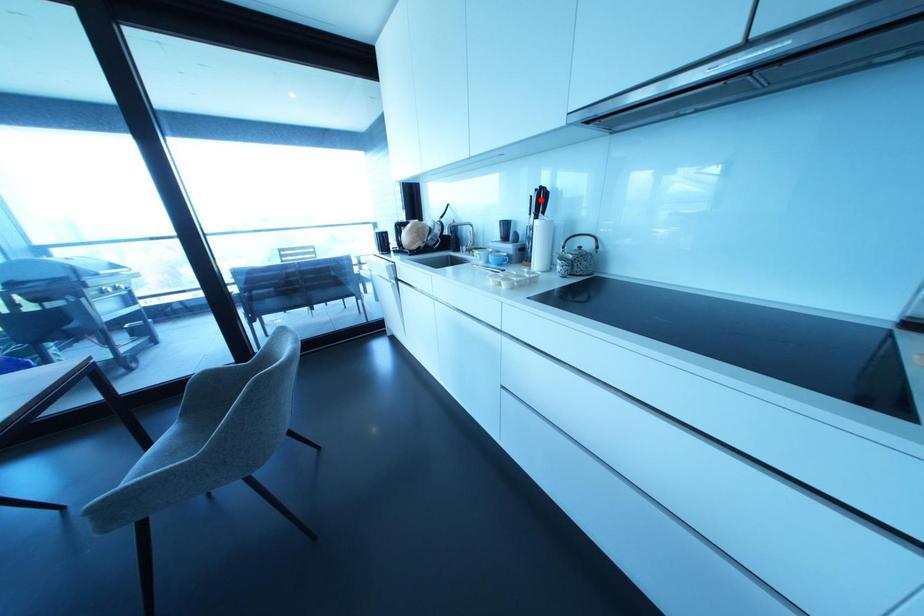
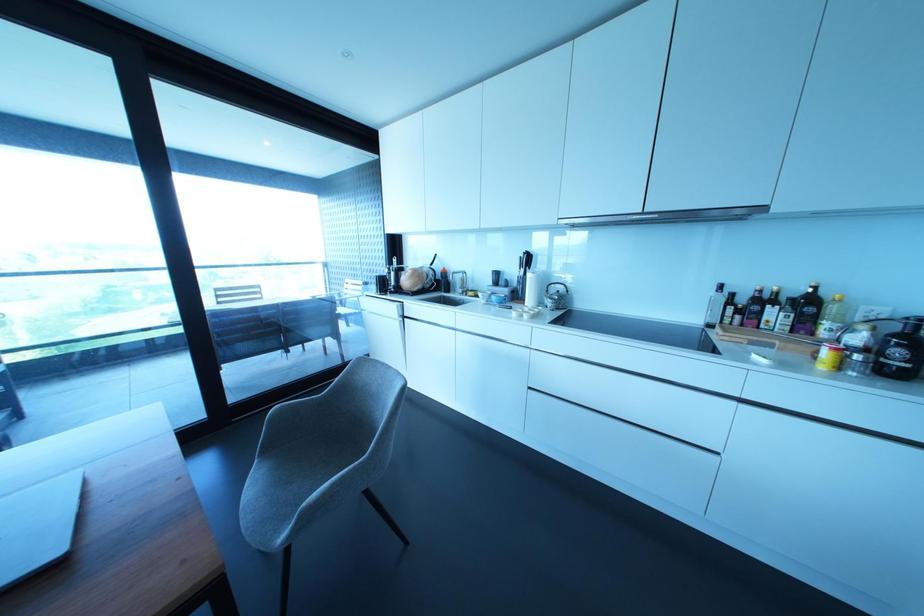
Locate, in the second image, the point that corresponds to the highlighted location in the first image.

(527, 259)